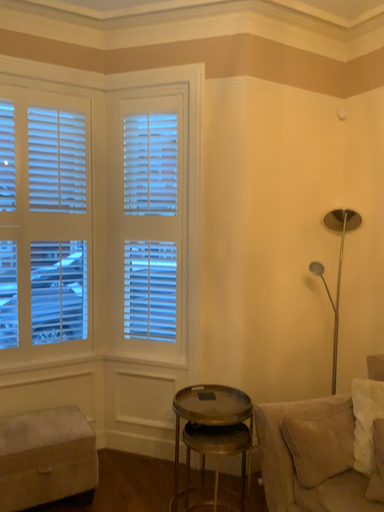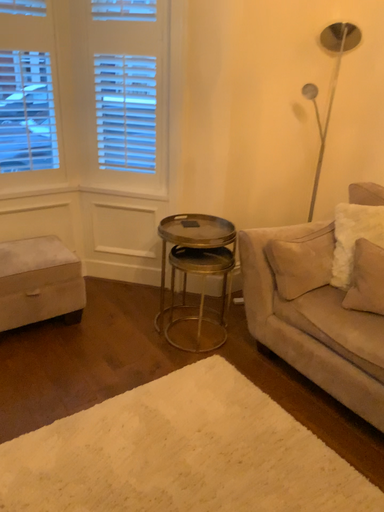
Question: Which way did the camera rotate in the video?

Choices:
 (A) rotated downward
 (B) rotated upward

Answer: (A)